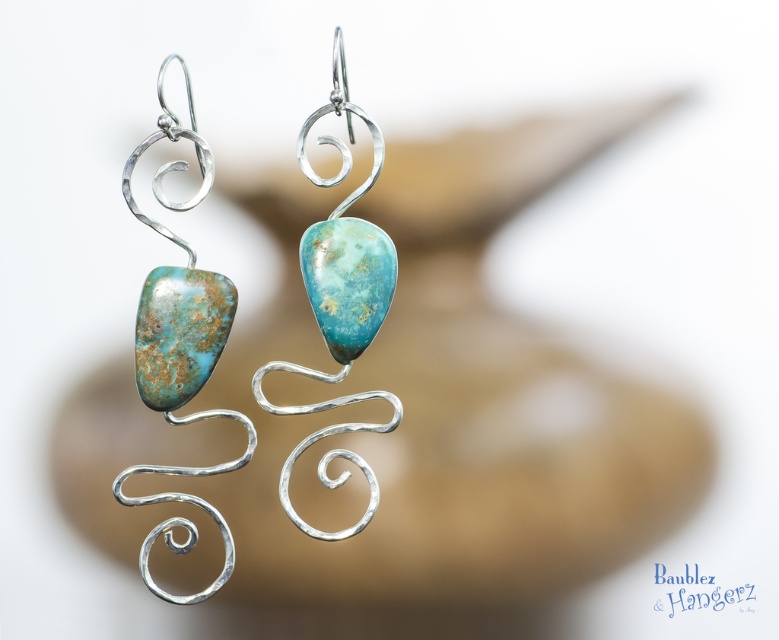
Can you confirm if turquoise stone at left is positioned above turquoise stone pendant at center?

Actually, turquoise stone at left is below turquoise stone pendant at center.

Does turquoise stone at left appear on the left side of turquoise stone pendant at center?

Correct, you'll find turquoise stone at left to the left of turquoise stone pendant at center.

Is point (175, 285) more distant than point (309, 292)?

That is False.

You are a GUI agent. You are given a task and a screenshot of the screen. Output one action in this format:
    pyautogui.click(x=<x>, y=<y>)
    Task: Click on the turquoise stone at left
    The width and height of the screenshot is (779, 640).
    Given the screenshot: What is the action you would take?
    pyautogui.click(x=178, y=342)

Does matte silver wire at center have a smaller size compared to turquoise stone pendant at center?

No.

Can you confirm if matte silver wire at center is positioned to the left of turquoise stone pendant at center?

Indeed, matte silver wire at center is positioned on the left side of turquoise stone pendant at center.

The image size is (779, 640). Describe the element at coordinates (339, 300) in the screenshot. I see `matte silver wire at center` at that location.

The width and height of the screenshot is (779, 640). In order to click on matte silver wire at center in this screenshot , I will do `click(339, 300)`.

Between turquoise stone at left and matte silver wire at center, which one has less height?

matte silver wire at center is shorter.

What are the coordinates of `turquoise stone at left` in the screenshot? It's located at (178, 342).